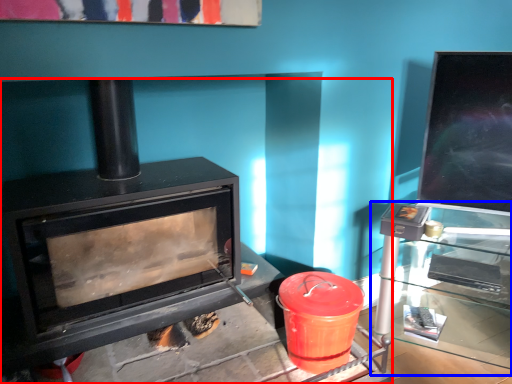
Question: Which object appears farthest to the camera in this image, wood burning stove (highlighted by a red box) or table (highlighted by a blue box)?

Choices:
 (A) wood burning stove
 (B) table

Answer: (B)